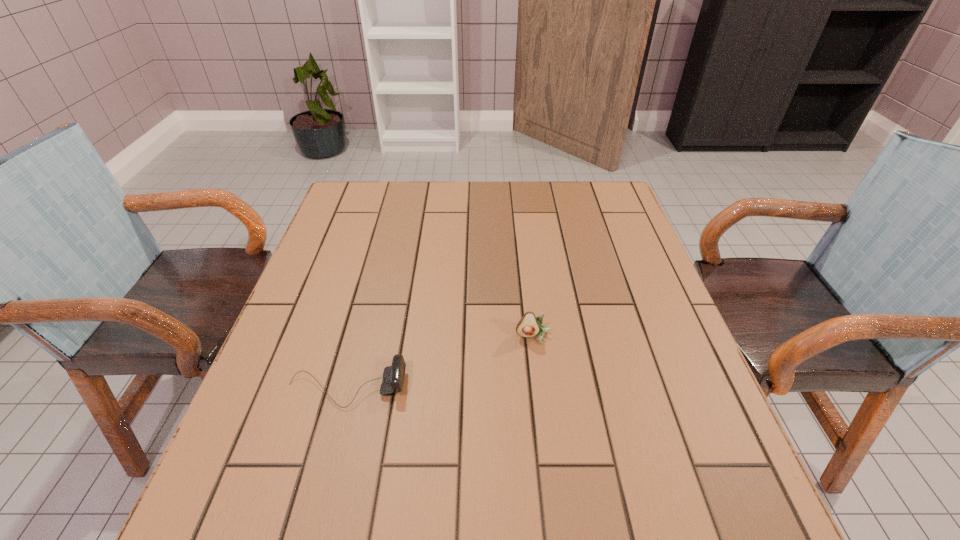
I want to click on vacant area that satisfies the following two spatial constraints: 1. on the seed side of the avocado; 2. on the front-facing side of the shorter object, so click(540, 388).

Locate an element on the screen. vacant region that satisfies the following two spatial constraints: 1. on the seed side of the taller object; 2. on the front-facing side of the nearer object is located at coordinates (540, 388).

Where is `free spot that satisfies the following two spatial constraints: 1. on the seed side of the right object; 2. on the front-facing side of the shorter object`? Image resolution: width=960 pixels, height=540 pixels. free spot that satisfies the following two spatial constraints: 1. on the seed side of the right object; 2. on the front-facing side of the shorter object is located at coordinates (540, 388).